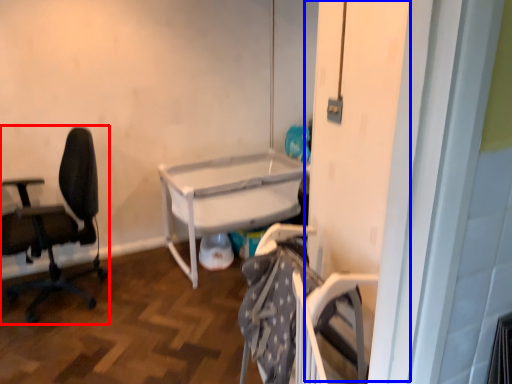
Question: Which of the following is the closest to the observer, chair (highlighted by a red box) or screen door (highlighted by a blue box)?

Choices:
 (A) chair
 (B) screen door

Answer: (B)